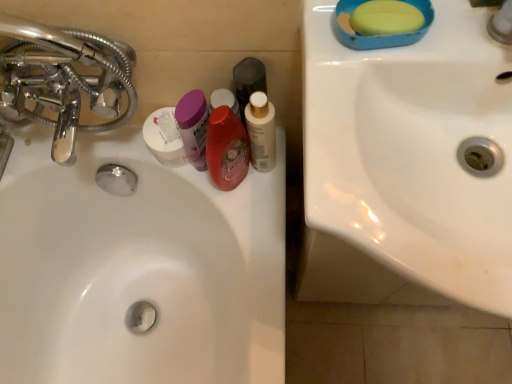
This screenshot has height=384, width=512. What are the coordinates of `free space in front of purple plastic container at center, the first mouthwash positioned from the left` in the screenshot? It's located at [x=245, y=235].